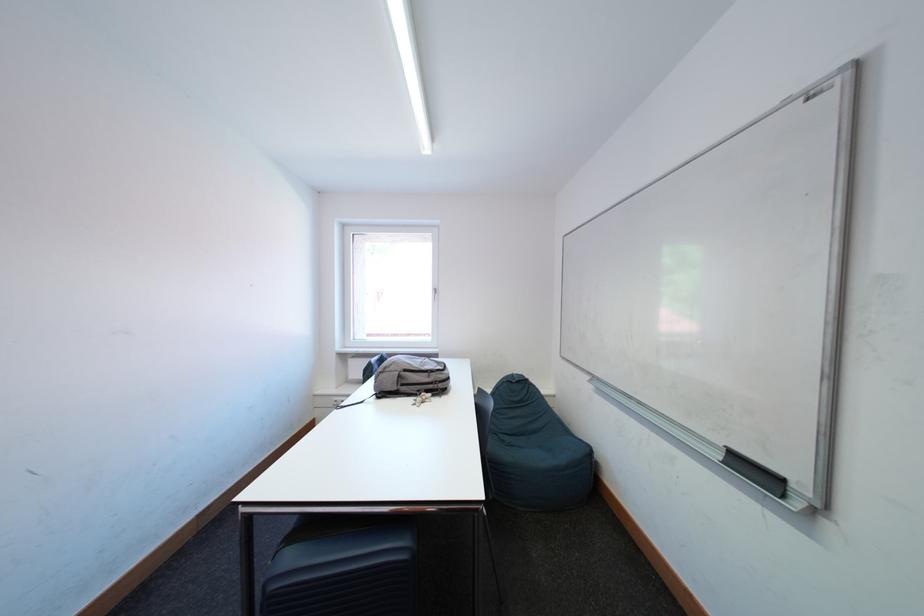
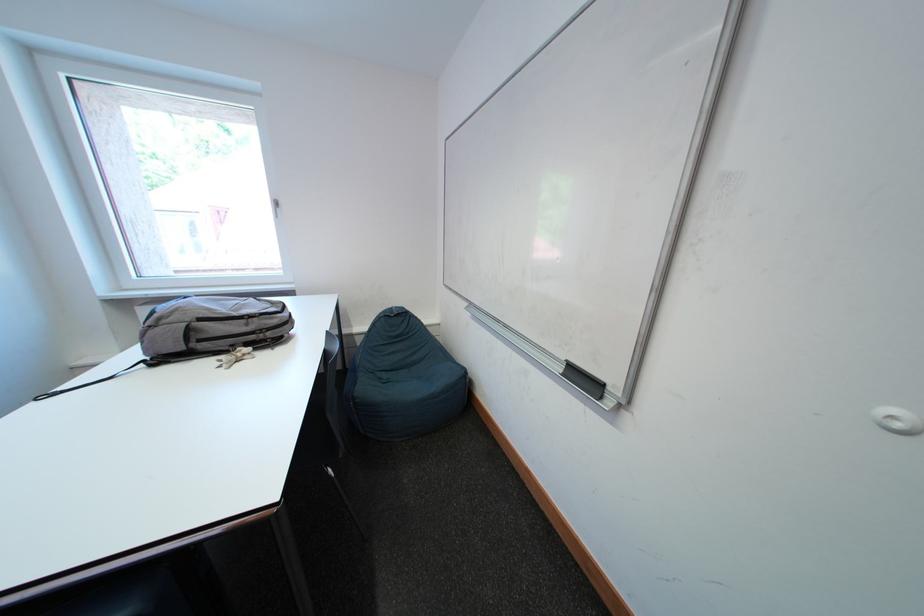
Based on the continuous images, in which direction is the camera rotating?

The rotation direction of the camera is right-down.